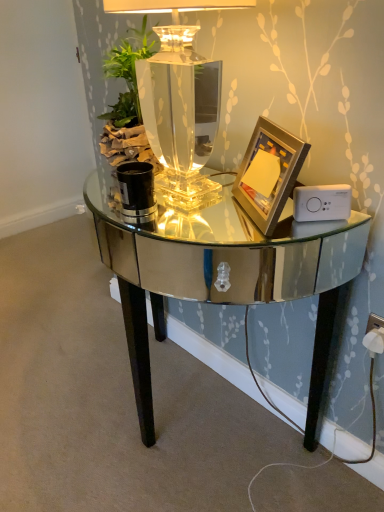
Question: Is mirrored glass table at center at the back of clear glass table lamp at center?

Choices:
 (A) yes
 (B) no

Answer: (B)

Question: From a real-world perspective, does clear glass table lamp at center stand above mirrored glass table at center?

Choices:
 (A) yes
 (B) no

Answer: (A)

Question: Considering the relative sizes of clear glass table lamp at center and mirrored glass table at center in the image provided, is clear glass table lamp at center bigger than mirrored glass table at center?

Choices:
 (A) yes
 (B) no

Answer: (B)

Question: From a real-world perspective, is clear glass table lamp at center below mirrored glass table at center?

Choices:
 (A) no
 (B) yes

Answer: (A)

Question: Can you confirm if clear glass table lamp at center is shorter than mirrored glass table at center?

Choices:
 (A) no
 (B) yes

Answer: (B)

Question: From the image's perspective, is gold metallic picture frame at right located above or below mirrored glass table at center?

Choices:
 (A) above
 (B) below

Answer: (A)

Question: In the image, is gold metallic picture frame at right positioned in front of or behind mirrored glass table at center?

Choices:
 (A) behind
 (B) front

Answer: (A)

Question: Looking at the image, does gold metallic picture frame at right seem bigger or smaller compared to mirrored glass table at center?

Choices:
 (A) big
 (B) small

Answer: (B)

Question: Considering the positions of gold metallic picture frame at right and mirrored glass table at center in the image, is gold metallic picture frame at right taller or shorter than mirrored glass table at center?

Choices:
 (A) short
 (B) tall

Answer: (A)

Question: In the image, is white plastic socket at lower right positioned in front of or behind mirrored glass table at center?

Choices:
 (A) behind
 (B) front

Answer: (A)

Question: In terms of width, does white plastic socket at lower right look wider or thinner when compared to mirrored glass table at center?

Choices:
 (A) thin
 (B) wide

Answer: (A)

Question: From their relative heights in the image, would you say white plastic socket at lower right is taller or shorter than mirrored glass table at center?

Choices:
 (A) short
 (B) tall

Answer: (A)

Question: From the image's perspective, relative to mirrored glass table at center, is white plastic socket at lower right above or below?

Choices:
 (A) above
 (B) below

Answer: (A)

Question: Looking at their shapes, would you say white plastic ipod at right is wider or thinner than mirrored glass table at center?

Choices:
 (A) wide
 (B) thin

Answer: (B)

Question: In terms of height, does white plastic ipod at right look taller or shorter compared to mirrored glass table at center?

Choices:
 (A) tall
 (B) short

Answer: (B)